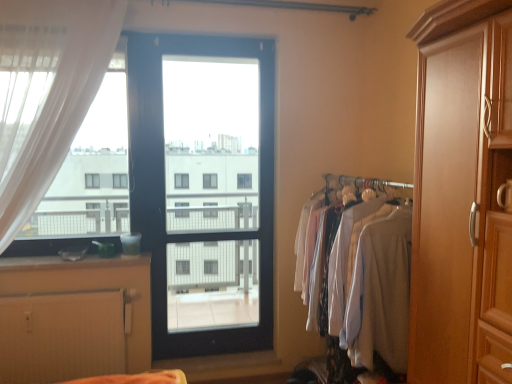
In order to click on empty space that is ontop of black glass door at center (from a real-world perspective) in this screenshot , I will do `click(209, 40)`.